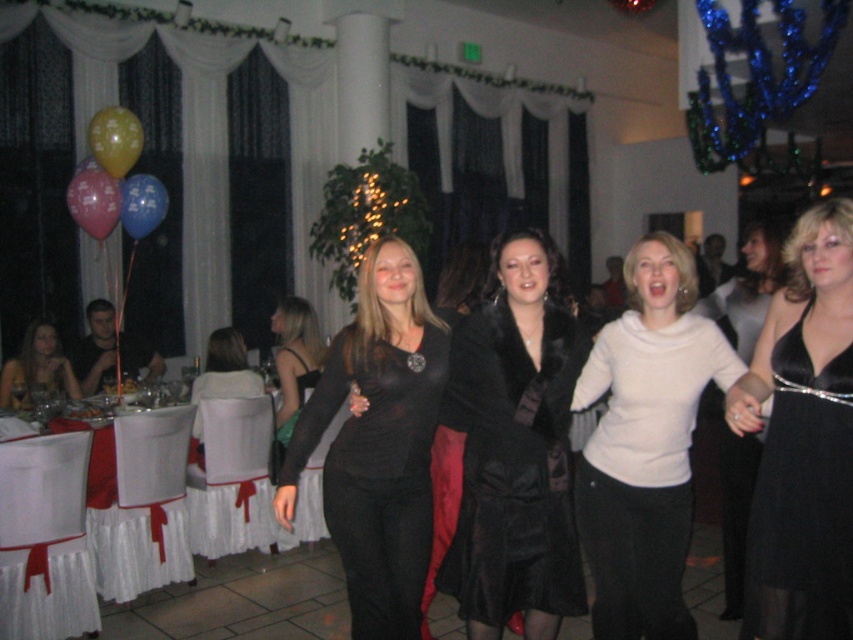
Question: Is matte black dress at center positioned before yellow rubber balloon at upper left?

Choices:
 (A) no
 (B) yes

Answer: (B)

Question: Based on their relative distances, which object is nearer to the black matte dress at center?

Choices:
 (A) black satin dress at lower right
 (B) pink glossy balloon at upper left

Answer: (A)

Question: Which point is farther from the camera taking this photo?

Choices:
 (A) (107, 170)
 (B) (486, 467)

Answer: (A)

Question: Among these objects, which one is nearest to the camera?

Choices:
 (A) blue metallic balloon at left
 (B) black satin dress at lower right

Answer: (B)

Question: Does black satin dress at center have a lesser width compared to matte black dress at lower left?

Choices:
 (A) no
 (B) yes

Answer: (B)

Question: Is black matte dress at center smaller than pink glossy balloon at upper left?

Choices:
 (A) no
 (B) yes

Answer: (A)